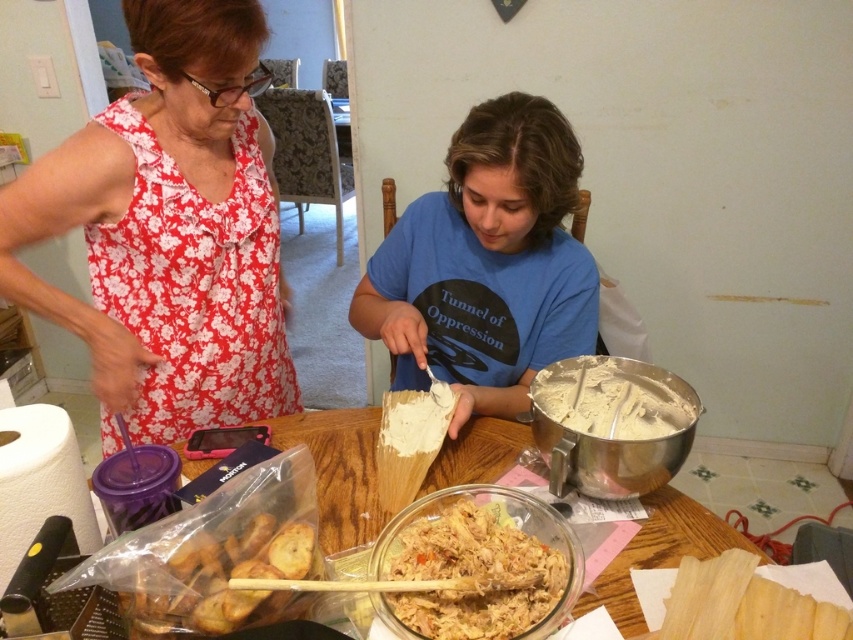
Question: From the image, what is the correct spatial relationship of floral fabric dress at upper left in relation to white creamy dough at center?

Choices:
 (A) right
 (B) left

Answer: (B)

Question: Which object is closer to the camera taking this photo?

Choices:
 (A) translucent plastic bag of breadsticks at lower left
 (B) floral fabric dress at upper left
 (C) translucent plastic bag at lower left

Answer: (A)

Question: Where is floral fabric dress at upper left located in relation to translucent plastic bag of breadsticks at lower left in the image?

Choices:
 (A) left
 (B) right

Answer: (A)

Question: Can you confirm if translucent plastic bag at lower left is positioned above translucent plastic bag of breadsticks at lower left?

Choices:
 (A) yes
 (B) no

Answer: (A)

Question: Which point is farther to the camera?

Choices:
 (A) white shredded chicken at center
 (B) translucent plastic bag of breadsticks at lower left
 (C) floral fabric dress at upper left
 (D) matte white paper at center

Answer: (D)

Question: Which of the following is the closest to the observer?

Choices:
 (A) matte white paper at center
 (B) floral fabric dress at upper left

Answer: (B)